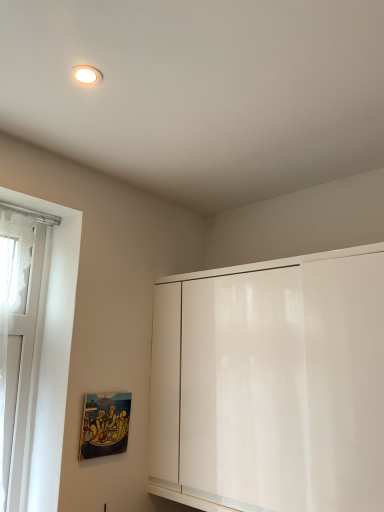
Question: Considering the relative sizes of white glass window at left and matte wooden picture frame at lower left in the image provided, is white glass window at left taller than matte wooden picture frame at lower left?

Choices:
 (A) no
 (B) yes

Answer: (B)

Question: Is white glass window at left not inside matte wooden picture frame at lower left?

Choices:
 (A) yes
 (B) no

Answer: (A)

Question: Is white glass window at left turned away from matte wooden picture frame at lower left?

Choices:
 (A) no
 (B) yes

Answer: (A)

Question: From a real-world perspective, is white glass window at left on matte wooden picture frame at lower left?

Choices:
 (A) no
 (B) yes

Answer: (B)

Question: From the image's perspective, is white glass window at left on top of matte wooden picture frame at lower left?

Choices:
 (A) yes
 (B) no

Answer: (A)

Question: Considering the positions of point (91, 425) and point (339, 382), is point (91, 425) closer or farther from the camera than point (339, 382)?

Choices:
 (A) closer
 (B) farther

Answer: (B)

Question: Considering the positions of matte wooden picture frame at lower left and white glossy cabinet at center in the image, is matte wooden picture frame at lower left bigger or smaller than white glossy cabinet at center?

Choices:
 (A) small
 (B) big

Answer: (A)

Question: Is matte wooden picture frame at lower left in front of or behind white glossy cabinet at center in the image?

Choices:
 (A) front
 (B) behind

Answer: (B)

Question: Visually, is matte wooden picture frame at lower left positioned to the left or to the right of white glossy cabinet at center?

Choices:
 (A) right
 (B) left

Answer: (B)

Question: From the image's perspective, is matte wooden picture frame at lower left located above or below white glass window at left?

Choices:
 (A) below
 (B) above

Answer: (A)

Question: Visually, is matte wooden picture frame at lower left positioned to the left or to the right of white glass window at left?

Choices:
 (A) left
 (B) right

Answer: (B)

Question: Considering the positions of matte wooden picture frame at lower left and white glass window at left in the image, is matte wooden picture frame at lower left wider or thinner than white glass window at left?

Choices:
 (A) wide
 (B) thin

Answer: (B)

Question: Relative to white glass window at left, is matte wooden picture frame at lower left in front or behind?

Choices:
 (A) front
 (B) behind

Answer: (B)

Question: Considering the positions of white glossy cabinet at center and matte wooden picture frame at lower left in the image, is white glossy cabinet at center taller or shorter than matte wooden picture frame at lower left?

Choices:
 (A) tall
 (B) short

Answer: (A)

Question: Is point (168, 373) closer or farther from the camera than point (97, 449)?

Choices:
 (A) closer
 (B) farther

Answer: (B)